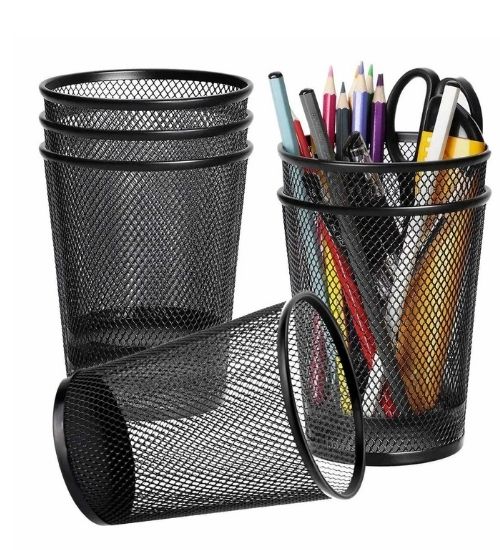
Identify the location of pencil holders. Image resolution: width=500 pixels, height=550 pixels. (342, 349), (358, 212), (382, 165), (189, 164), (185, 133), (191, 101).